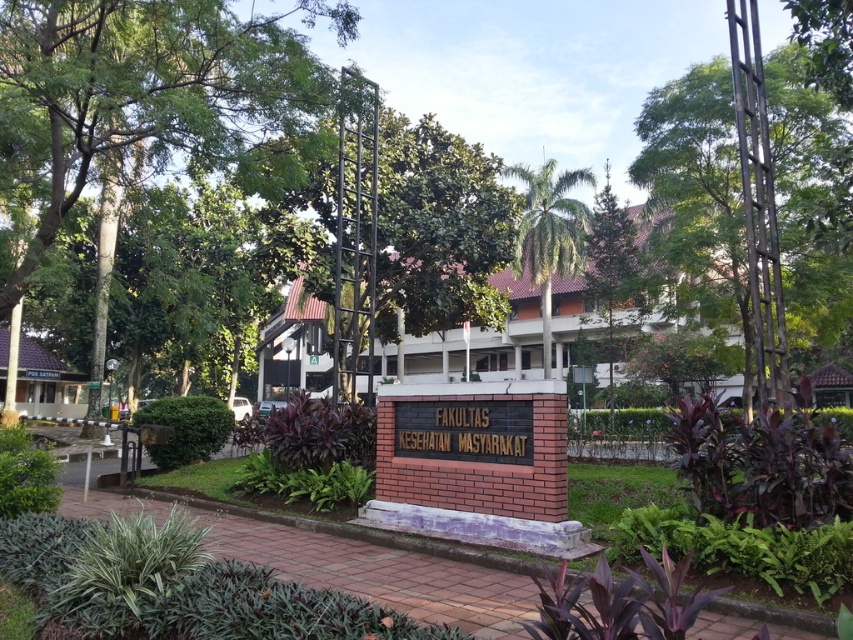
You are a visitor at the campus and want to take a photo of the brown brick building at center and the green leafy palm tree at center. Which one should you focus on first if you want to capture both in the frame without moving the camera?

The brown brick building at center is shorter than the green leafy palm tree at center, so you should focus on the taller green leafy palm tree at center first to ensure it fits in the frame.

Consider the image. You are a visitor arriving at the campus and want to take a photo of the brown brick building at center with the green leafy tree at upper left in the background. Is the tree positioned to the left or right side of the building?

The green leafy tree at upper left is positioned to the left of the brown brick building at center, so it would appear on the left side in the photo.